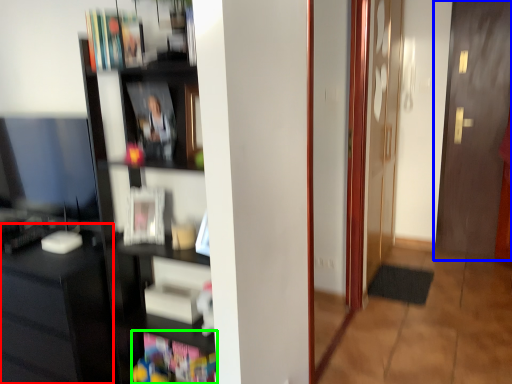
Question: Estimate the real-world distances between objects in this image. Which object is farther from computer desk (highlighted by a red box), door (highlighted by a blue box) or book (highlighted by a green box)?

Choices:
 (A) door
 (B) book

Answer: (A)